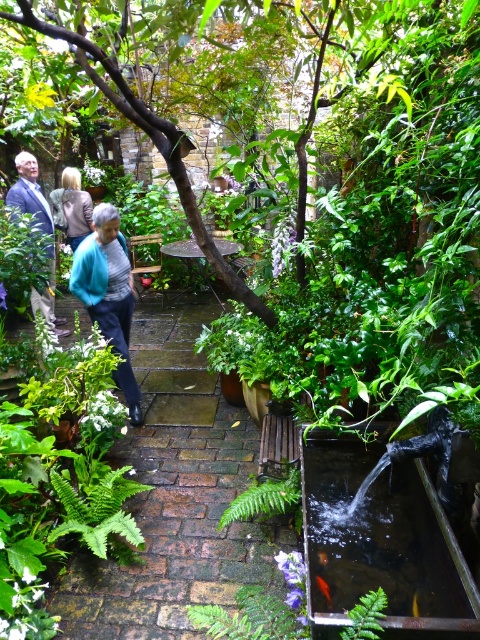
Question: Does blue wool sweater at left come behind orange translucent fish at lower center?

Choices:
 (A) no
 (B) yes

Answer: (B)

Question: Which of these objects is positioned farthest from the orange translucent fish at lower center?

Choices:
 (A) green leafy fern at center
 (B) green leafy fern at lower left
 (C) gold shiny fish at lower center

Answer: (B)

Question: Is teal sweater at center bigger than orange glossy fish at center?

Choices:
 (A) no
 (B) yes

Answer: (B)

Question: Which object appears farthest from the camera in this image?

Choices:
 (A) teal sweater at center
 (B) green leafy fern at lower left

Answer: (A)

Question: In this image, where is green matte fern at center located relative to green leafy fern at center?

Choices:
 (A) above
 (B) below

Answer: (B)

Question: Which point is farther to the camera?

Choices:
 (A) (369, 602)
 (B) (316, 580)
 (C) (33, 211)

Answer: (C)